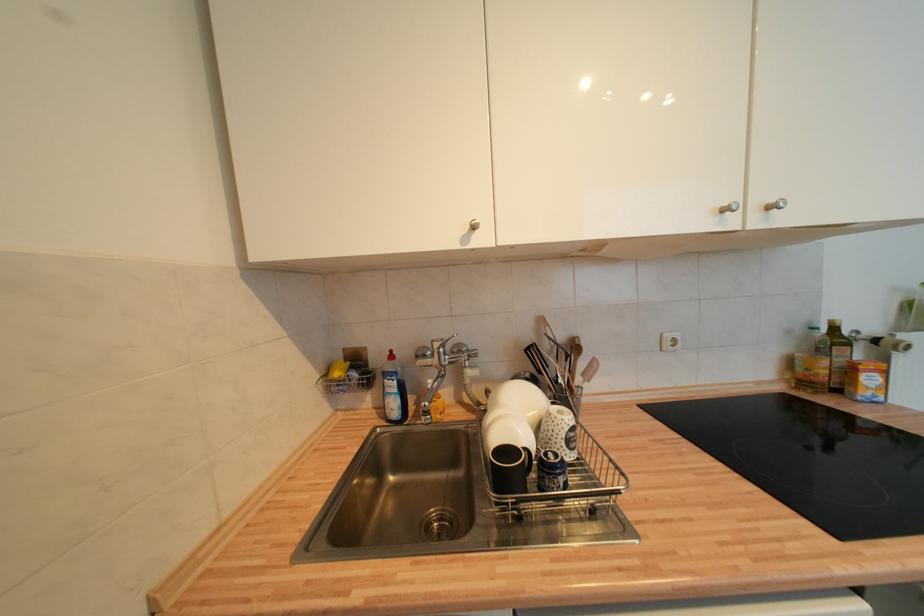
What are the coordinates of `faucet handle` in the screenshot? It's located at (468, 363).